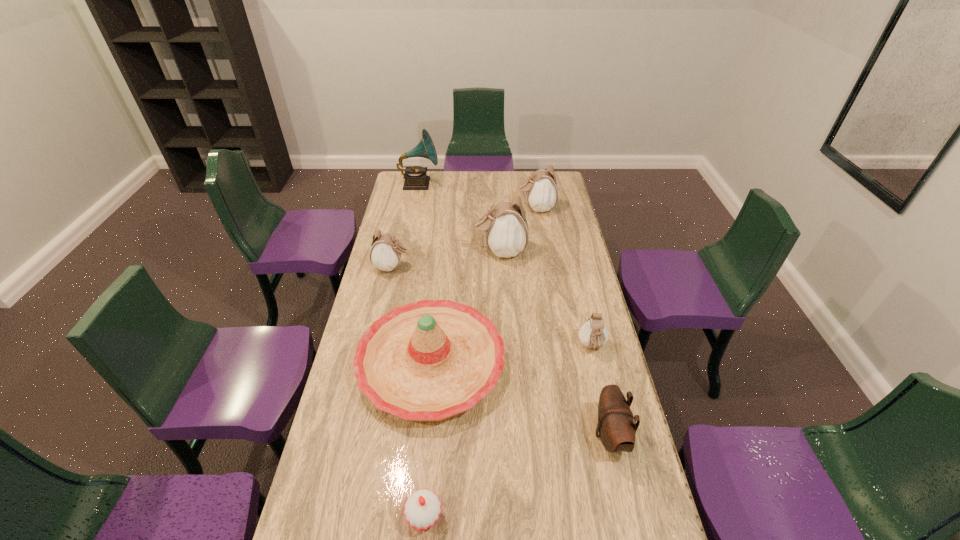
I want to click on vacant space that satisfies the following two spatial constraints: 1. on the front-facing side of the pink cupcake; 2. on the left side of the second smallest white pouch, so click(x=336, y=517).

The height and width of the screenshot is (540, 960). What are the coordinates of `vacant area in the image that satisfies the following two spatial constraints: 1. from the horn of the phonograph_record; 2. on the back side of the sombrero` in the screenshot? It's located at (383, 364).